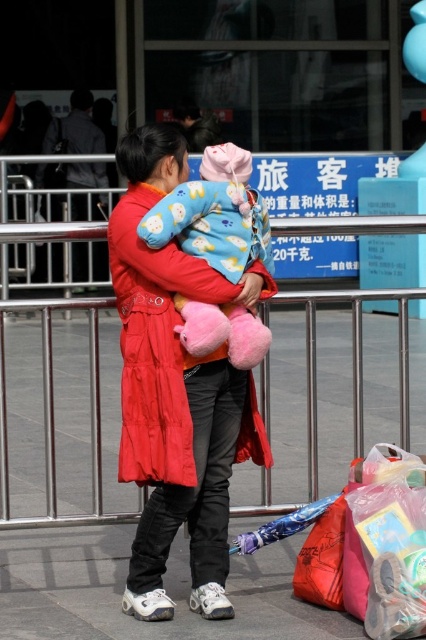
Question: Does matte red coat at center appear under metallic silver rail at center?

Choices:
 (A) yes
 (B) no

Answer: (B)

Question: Is metallic silver rail at center closer to camera compared to fluffy pink plush at center?

Choices:
 (A) yes
 (B) no

Answer: (B)

Question: Is matte red coat at center to the right of metallic silver rail at center from the viewer's perspective?

Choices:
 (A) no
 (B) yes

Answer: (B)

Question: Estimate the real-world distances between objects in this image. Which object is closer to the fluffy pink plush at center?

Choices:
 (A) metallic silver rail at center
 (B) matte red coat at center
 (C) plastic bag at lower right

Answer: (B)

Question: Which object is closer to the camera taking this photo?

Choices:
 (A) metallic silver rail at center
 (B) matte red coat at center
 (C) fluffy pink plush at center
 (D) plastic bag at lower right

Answer: (C)

Question: Which object appears closest to the camera in this image?

Choices:
 (A) fluffy pink plush at center
 (B) matte red coat at center
 (C) plastic bag at lower right
 (D) metallic silver rail at center

Answer: (A)